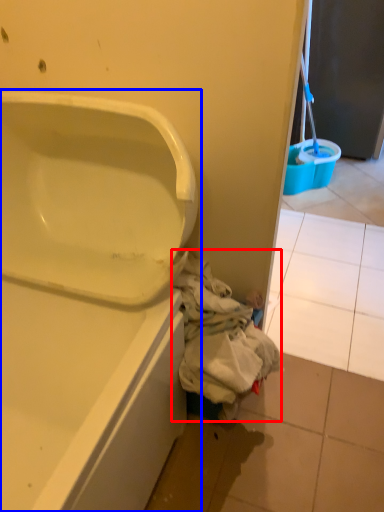
Question: Among these objects, which one is nearest to the camera, garbage (highlighted by a red box) or bathtub (highlighted by a blue box)?

Choices:
 (A) garbage
 (B) bathtub

Answer: (B)